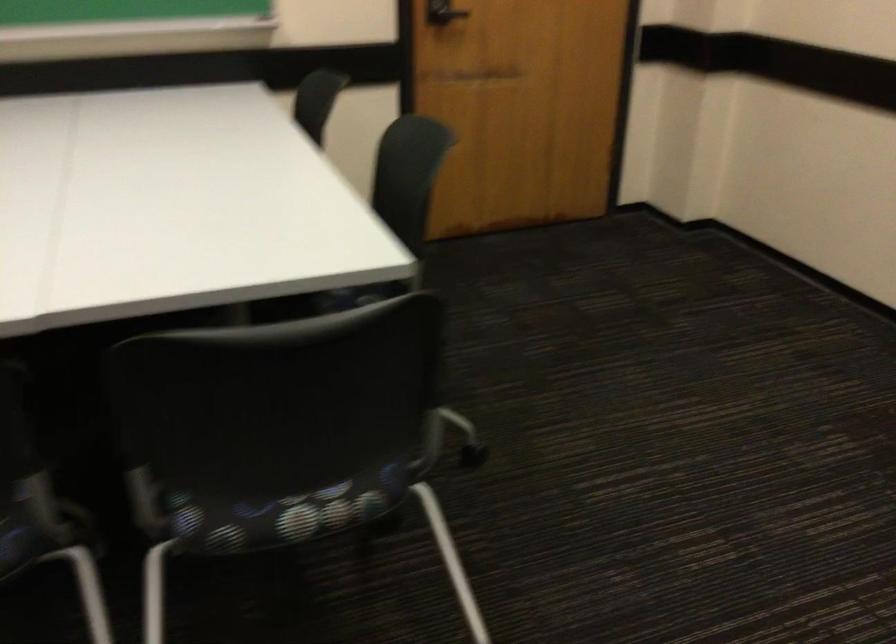
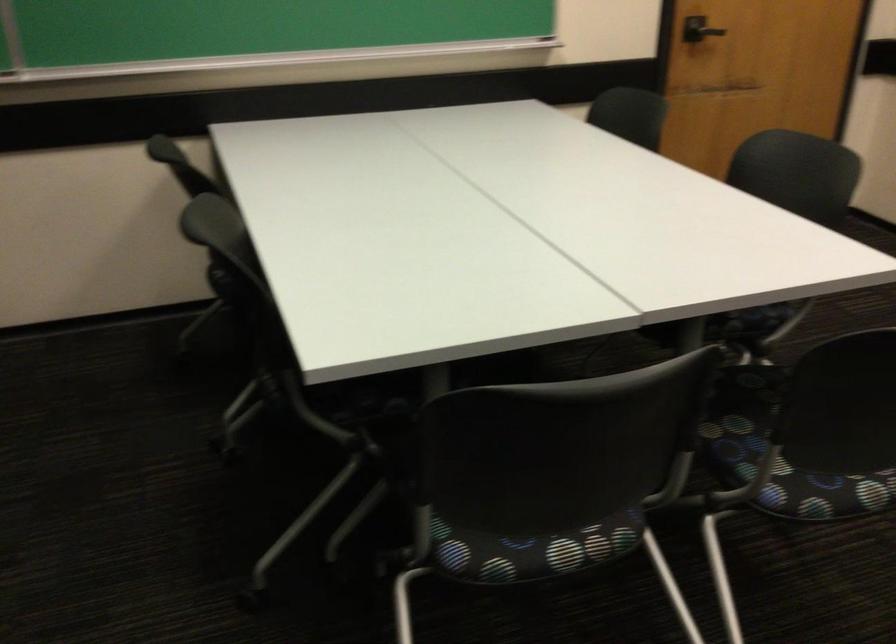
Question: The first image is from the beginning of the video and the second image is from the end. How did the camera likely rotate when shooting the video?

Choices:
 (A) Left
 (B) Right
 (C) Up
 (D) Down

Answer: (A)